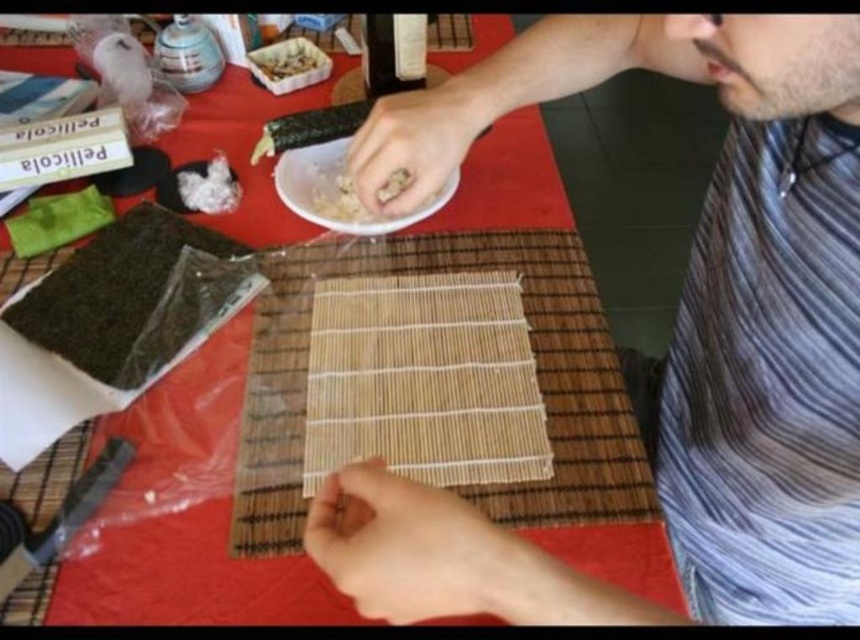
Is bamboo mat at center to the left of white matte plate at center from the viewer's perspective?

No, bamboo mat at center is not to the left of white matte plate at center.

Does point (545, 362) come closer to viewer compared to point (347, 138)?

Yes, point (545, 362) is closer to viewer.

The height and width of the screenshot is (640, 860). In order to click on bamboo mat at center in this screenshot , I will do `click(538, 371)`.

Is striped cotton shirt at center above white matte plate at center?

Incorrect, striped cotton shirt at center is not positioned above white matte plate at center.

Is striped cotton shirt at center smaller than white matte plate at center?

Actually, striped cotton shirt at center might be larger than white matte plate at center.

Measure the distance between point (846, 275) and camera.

The distance of point (846, 275) from camera is 41.88 centimeters.

Identify the location of striped cotton shirt at center. Image resolution: width=860 pixels, height=640 pixels. (717, 285).

From the picture: Between white matte plate at center and shiny plastic container at upper center, which one is positioned lower?

white matte plate at center is below.

Image resolution: width=860 pixels, height=640 pixels. What do you see at coordinates (338, 192) in the screenshot?
I see `white matte plate at center` at bounding box center [338, 192].

Locate an element on the screen. Image resolution: width=860 pixels, height=640 pixels. white matte plate at center is located at coordinates (338, 192).

At what (x,y) coordinates should I click in order to perform the action: click on white matte plate at center. Please return your answer as a coordinate pair (x, y). This screenshot has height=640, width=860. Looking at the image, I should click on (338, 192).